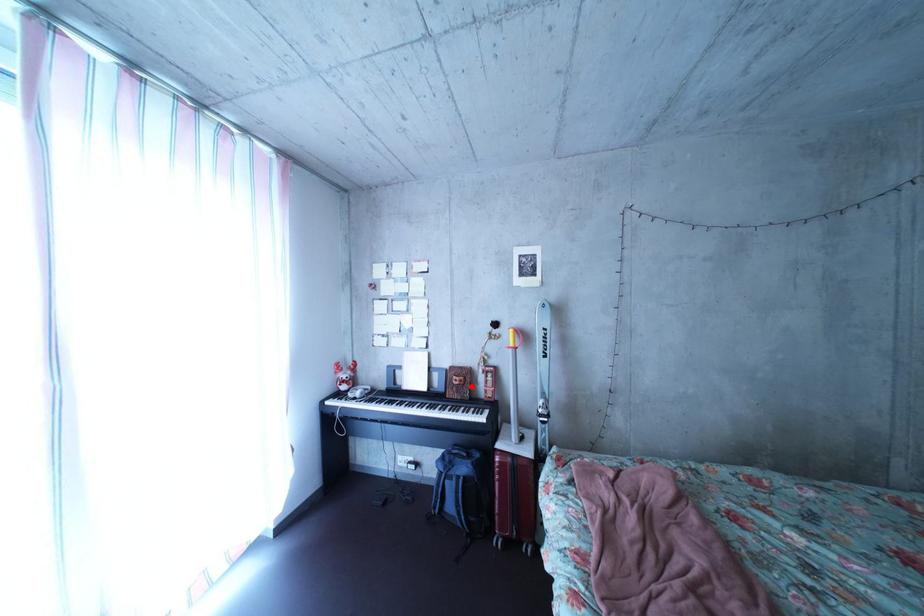
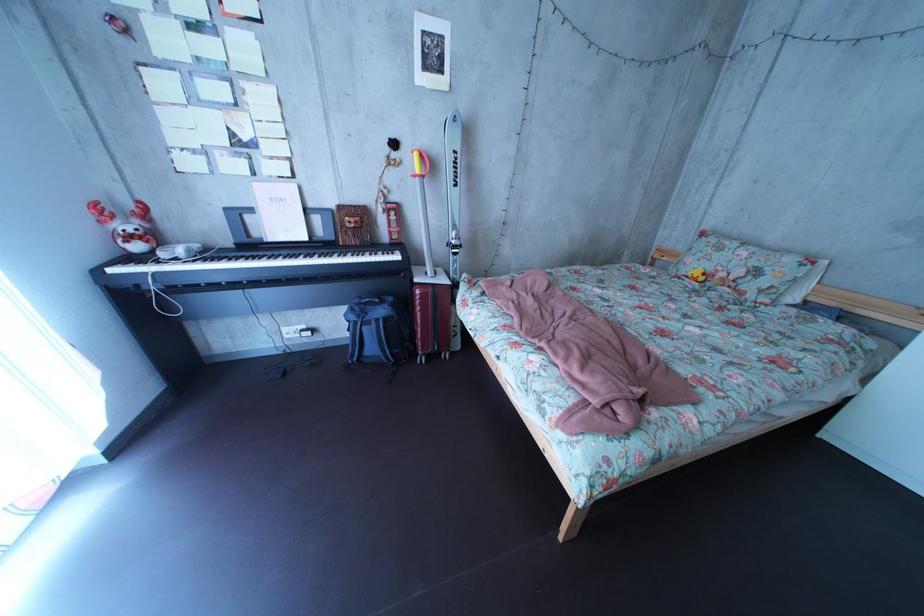
Question: I am providing you with two images of the same scene from different viewpoints. A red point is shown in image1. For the corresponding object point in image2, is it positioned nearer or farther from the camera?

Choices:
 (A) Nearer
 (B) Farther

Answer: (A)